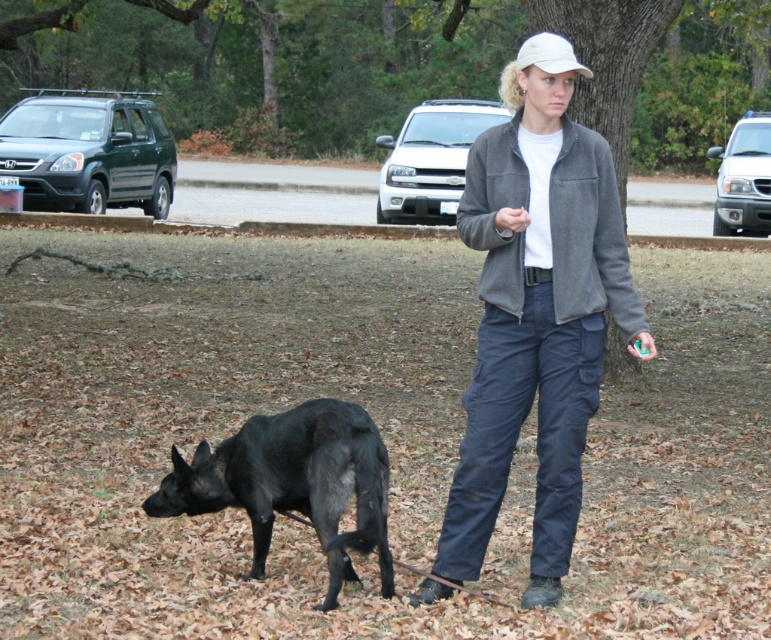
Consider the image. You are a photographer trying to capture a photo of the gray fleece jacket at center and the black matte dog at lower left. If you want to ensure both subjects are fully visible in the frame, which one should you focus on first to avoid cropping?

The gray fleece jacket at center is much taller than the black matte dog at lower left. To ensure both are fully visible, focus on the taller subject first, which is the gray fleece jacket at center, as it requires more vertical space in the frame.

You are a photographer standing in the park and want to take a photo of the gray fleece jacket at center and the black matte dog at lower left. Which object should you focus on first to ensure both are in focus?

You should focus on the gray fleece jacket at center first because it is closer to the viewer than the black matte dog at lower left, so adjusting focus from near to far will help both be in focus.

You are a photographer trying to capture a clear photo of the black matte dog at lower left and the white matte baseball cap at upper center. Which object should you focus on first if you want to ensure both are in focus without adjusting the camera settings?

The black matte dog at lower left is not as tall as the white matte baseball cap at upper center, so you should focus on the white matte baseball cap at upper center first since it is taller and will require a closer focus point to ensure both are in focus.